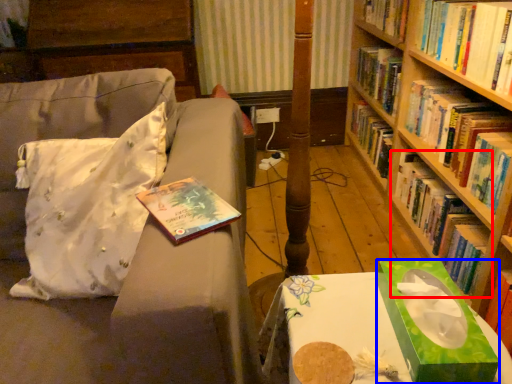
Question: Among these objects, which one is nearest to the camera, book (highlighted by a red box) or book cover (highlighted by a blue box)?

Choices:
 (A) book
 (B) book cover

Answer: (B)